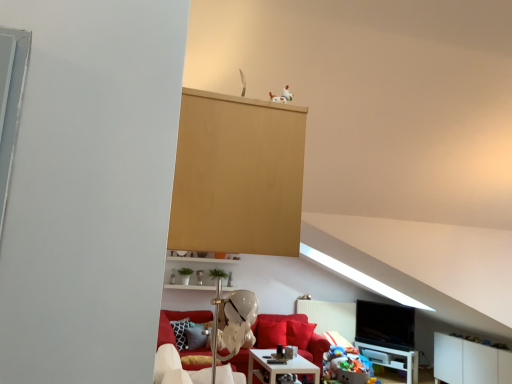
Question: Would you say multicolored plush toys at lower right contains velvet red couch at center?

Choices:
 (A) no
 (B) yes

Answer: (A)

Question: Can you confirm if multicolored plush toys at lower right is positioned to the right of velvet red couch at center?

Choices:
 (A) no
 (B) yes

Answer: (B)

Question: Is multicolored plush toys at lower right oriented towards velvet red couch at center?

Choices:
 (A) no
 (B) yes

Answer: (A)

Question: From a real-world perspective, is multicolored plush toys at lower right located higher than velvet red couch at center?

Choices:
 (A) no
 (B) yes

Answer: (A)

Question: Does multicolored plush toys at lower right have a larger size compared to velvet red couch at center?

Choices:
 (A) yes
 (B) no

Answer: (B)

Question: Looking at their shapes, would you say black glossy tv at lower right is wider or thinner than white matte dog at upper center?

Choices:
 (A) thin
 (B) wide

Answer: (B)

Question: From their relative heights in the image, would you say black glossy tv at lower right is taller or shorter than white matte dog at upper center?

Choices:
 (A) tall
 (B) short

Answer: (A)

Question: From the image's perspective, is black glossy tv at lower right located above or below white matte dog at upper center?

Choices:
 (A) below
 (B) above

Answer: (A)

Question: Relative to white matte dog at upper center, is black glossy tv at lower right in front or behind?

Choices:
 (A) front
 (B) behind

Answer: (B)

Question: Is white plastic swivel chair at lower center in front of or behind white glossy table at lower right, positioned as the 2th table in top-to-bottom order, in the image?

Choices:
 (A) front
 (B) behind

Answer: (A)

Question: Is white plastic swivel chair at lower center to the left or to the right of white glossy table at lower right, the 2th table positioned from the left, in the image?

Choices:
 (A) right
 (B) left

Answer: (B)

Question: From a real-world perspective, is white plastic swivel chair at lower center positioned above or below white glossy table at lower right, positioned as the 2th table in top-to-bottom order?

Choices:
 (A) below
 (B) above

Answer: (B)

Question: Would you say white plastic swivel chair at lower center is inside or outside white glossy table at lower right, which ranks as the first table in back-to-front order?

Choices:
 (A) outside
 (B) inside

Answer: (A)

Question: Based on their sizes in the image, would you say white matte dog at upper center is bigger or smaller than white glossy table at lower right, the 2th table positioned from the left?

Choices:
 (A) big
 (B) small

Answer: (B)

Question: From the image's perspective, relative to white glossy table at lower right, the 2th table positioned from the left, is white matte dog at upper center above or below?

Choices:
 (A) above
 (B) below

Answer: (A)